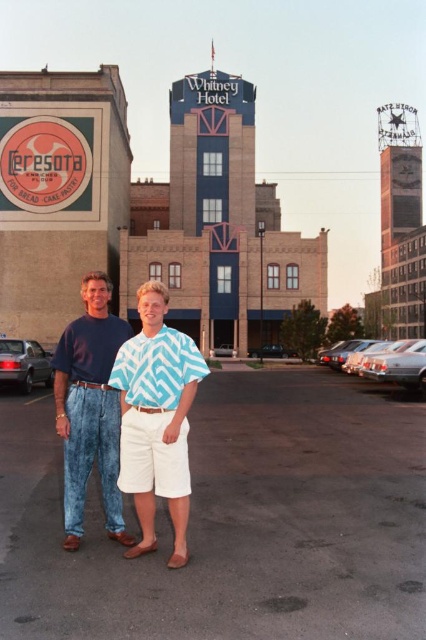
Question: Which of the following is the closest to the observer?

Choices:
 (A) (264, 355)
 (B) (365, 369)
 (C) (406, 444)

Answer: (C)

Question: Can you confirm if dark asphalt parking lot at center is positioned to the left of shiny silver sedan at right?

Choices:
 (A) yes
 (B) no

Answer: (A)

Question: Estimate the real-world distances between objects in this image. Which object is closer to the denim pants at center?

Choices:
 (A) silver metallic sedan at center
 (B) matte black sedan at center
 (C) dark asphalt parking lot at center

Answer: (C)

Question: Which point is farther from the camera taking this photo?

Choices:
 (A) (212, 570)
 (B) (75, 440)

Answer: (B)

Question: Does silver metallic sedan at left appear over silver metallic sedan at center?

Choices:
 (A) no
 (B) yes

Answer: (B)

Question: In this image, where is denim pants at center located relative to silver metallic sedan at left?

Choices:
 (A) above
 (B) below

Answer: (B)